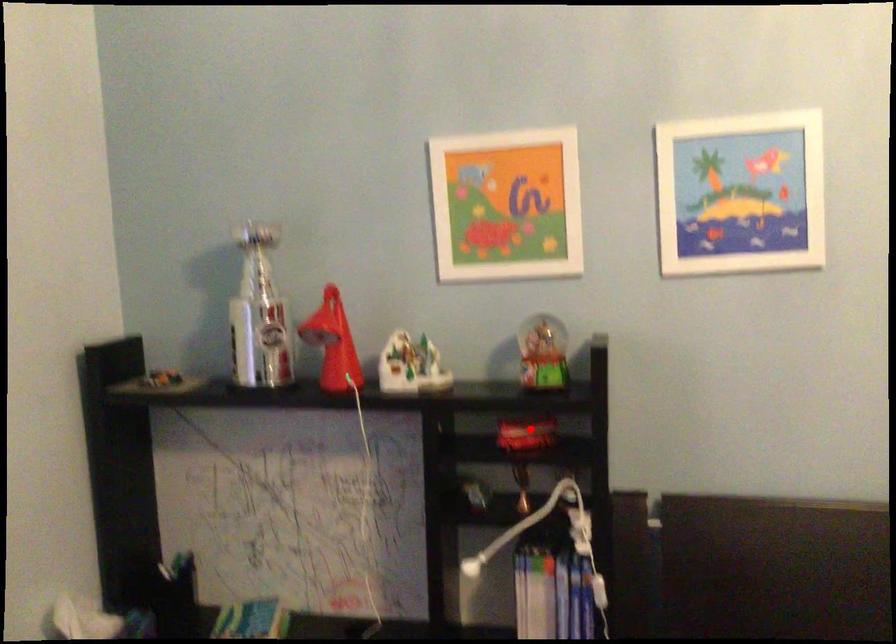
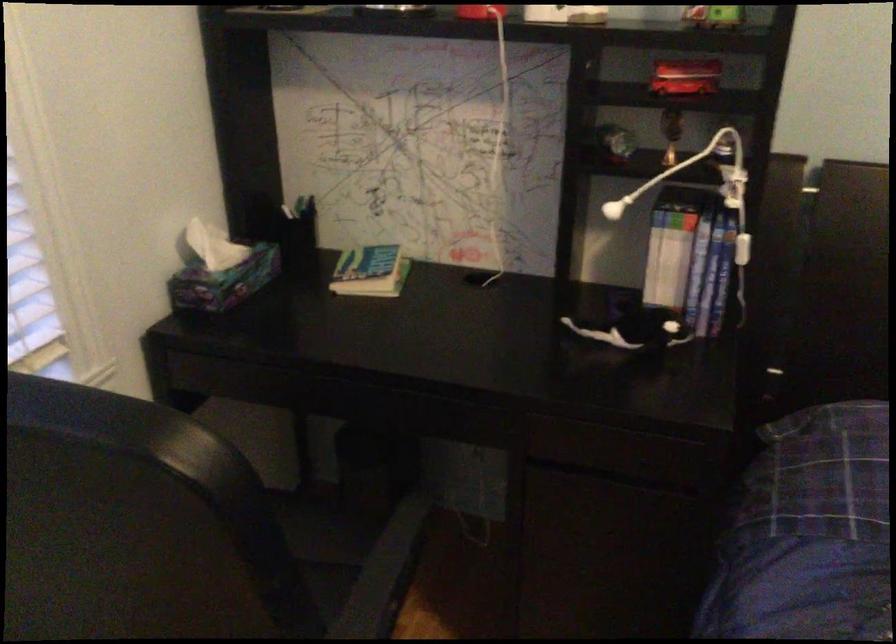
Question: I am providing you with two images of the same scene from different viewpoints. Given a red point in image1, look at the same physical point in image2. Is it:

Choices:
 (A) Closer to the viewpoint
 (B) Farther from the viewpoint

Answer: (A)